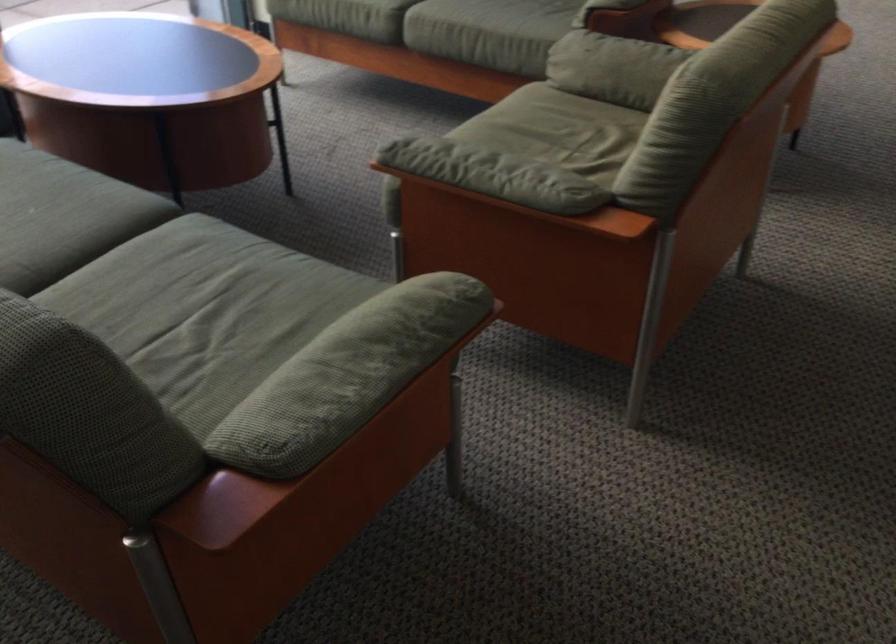
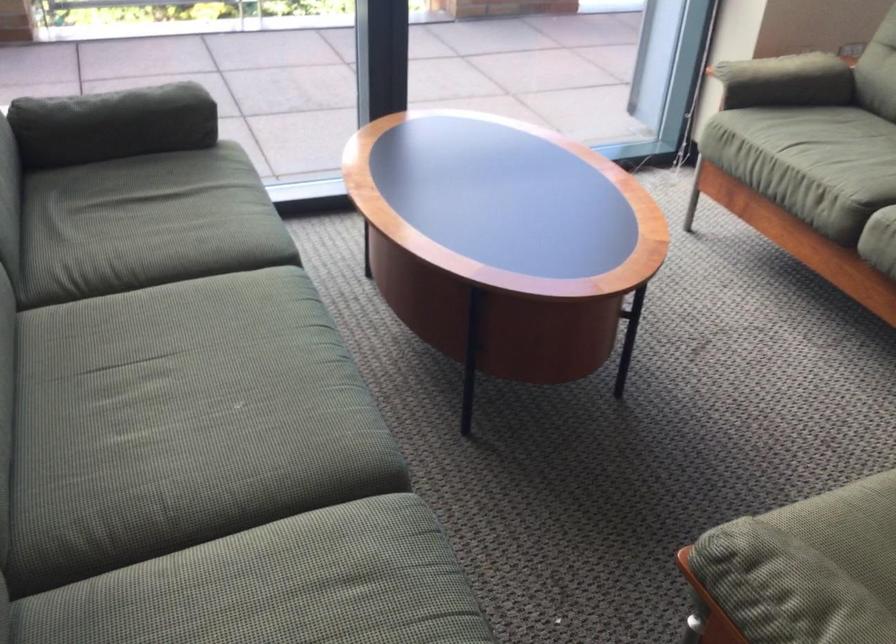
Question: How did the camera likely rotate?

Choices:
 (A) Left
 (B) Right
 (C) Up
 (D) Down

Answer: (A)